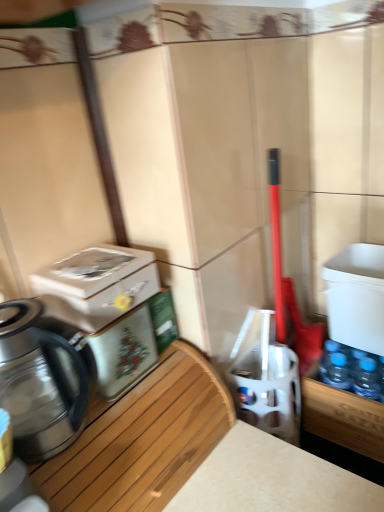
The image size is (384, 512). Find the location of `free space above woodenmaterial/texture at left (from a real-world perspective)`. free space above woodenmaterial/texture at left (from a real-world perspective) is located at coordinates (117, 398).